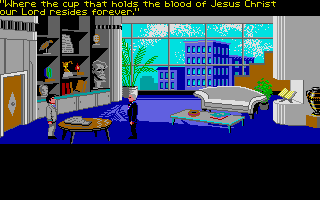
Where is `window pane`? window pane is located at coordinates (138, 53), (178, 50), (144, 76).